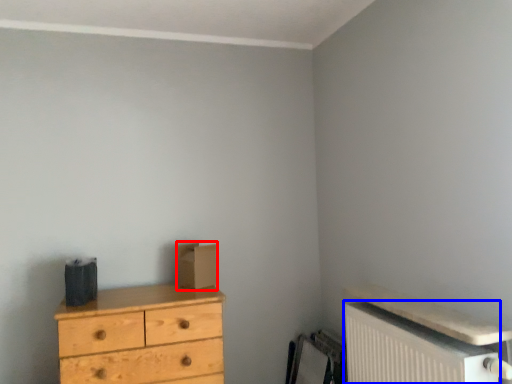
Question: Which object appears farthest to the camera in this image, cardboard box (highlighted by a red box) or radiator (highlighted by a blue box)?

Choices:
 (A) cardboard box
 (B) radiator

Answer: (A)